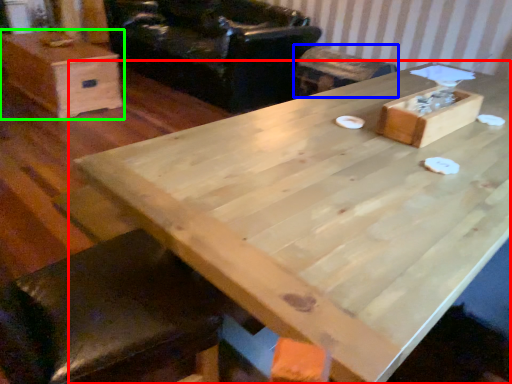
Question: Which object is positioned farthest from table (highlighted by a red box)? Select from bar stool (highlighted by a blue box) and box (highlighted by a green box).

Choices:
 (A) bar stool
 (B) box

Answer: (B)